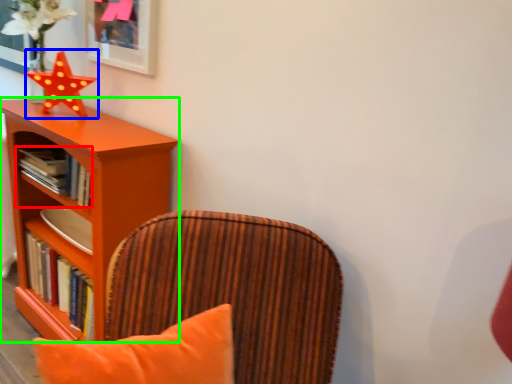
Question: Which object is the closest to the book (highlighted by a red box)? Choose among these: star (highlighted by a blue box) or shelf (highlighted by a green box).

Choices:
 (A) star
 (B) shelf

Answer: (B)